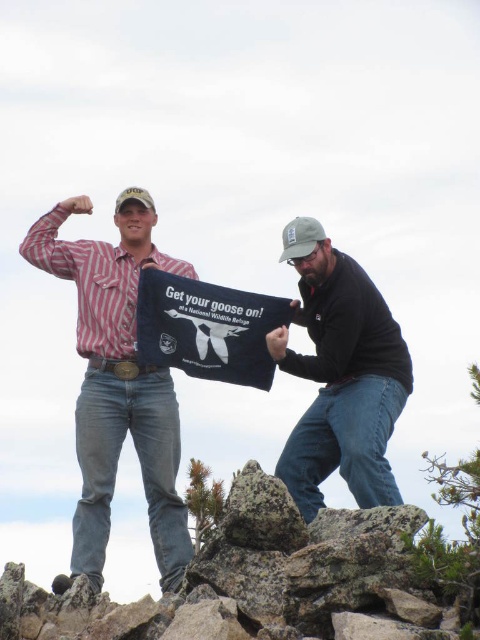
Describe the element at coordinates (269, 580) in the screenshot. This screenshot has height=640, width=480. I see `rough granite rocks at center` at that location.

Between point (284, 547) and point (171, 298), which one is positioned behind?

The point (171, 298) is more distant.

Where is `rough granite rocks at center`? rough granite rocks at center is located at coordinates (269, 580).

Which is behind, point (345, 378) or point (172, 321)?

The point (172, 321) is more distant.

How far apart are dark blue fabric sign at center and black fabric sign at center?

dark blue fabric sign at center is 28.44 feet away from black fabric sign at center.

Between point (335, 266) and point (217, 330), which one is positioned in front?

Point (335, 266) is in front.

This screenshot has height=640, width=480. I want to click on dark blue fabric sign at center, so click(x=340, y=376).

Who is lower down, matte red plaid shirt at center or dark blue fabric sign at center?

Positioned lower is matte red plaid shirt at center.

Is point (127, 324) in front of point (382, 436)?

No, (127, 324) is further to viewer.

Locate an element on the screen. The width and height of the screenshot is (480, 640). matte red plaid shirt at center is located at coordinates (118, 381).